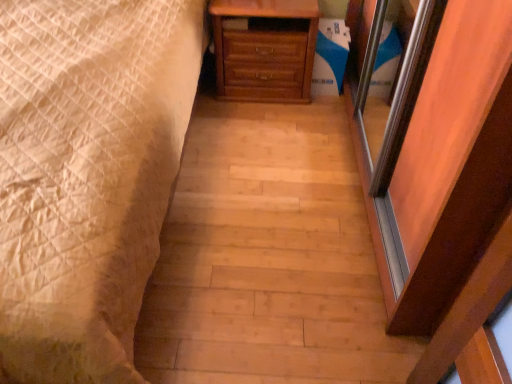
Question: Considering the relative sizes of white quilted bed at left and wooden chest of drawers at center in the image provided, is white quilted bed at left smaller than wooden chest of drawers at center?

Choices:
 (A) yes
 (B) no

Answer: (B)

Question: Can you confirm if white quilted bed at left is bigger than wooden chest of drawers at center?

Choices:
 (A) yes
 (B) no

Answer: (A)

Question: Does white quilted bed at left have a greater height compared to wooden chest of drawers at center?

Choices:
 (A) yes
 (B) no

Answer: (A)

Question: From the image's perspective, is white quilted bed at left below wooden chest of drawers at center?

Choices:
 (A) no
 (B) yes

Answer: (B)

Question: Is white quilted bed at left turned away from wooden chest of drawers at center?

Choices:
 (A) no
 (B) yes

Answer: (A)

Question: Is white quilted bed at left closer to the viewer compared to wooden chest of drawers at center?

Choices:
 (A) no
 (B) yes

Answer: (B)

Question: Is wooden chest of drawers at center far away from white quilted bed at left?

Choices:
 (A) no
 (B) yes

Answer: (A)

Question: From the image's perspective, would you say wooden chest of drawers at center is shown under white quilted bed at left?

Choices:
 (A) no
 (B) yes

Answer: (A)

Question: Does wooden chest of drawers at center have a lesser height compared to white quilted bed at left?

Choices:
 (A) yes
 (B) no

Answer: (A)

Question: Is wooden chest of drawers at center to the left of white quilted bed at left from the viewer's perspective?

Choices:
 (A) yes
 (B) no

Answer: (B)

Question: From a real-world perspective, is wooden chest of drawers at center positioned over white quilted bed at left based on gravity?

Choices:
 (A) no
 (B) yes

Answer: (A)

Question: From a real-world perspective, is wooden chest of drawers at center below white quilted bed at left?

Choices:
 (A) no
 (B) yes

Answer: (B)

Question: From a real-world perspective, is wooden chest of drawers at center above or below white quilted bed at left?

Choices:
 (A) below
 (B) above

Answer: (A)